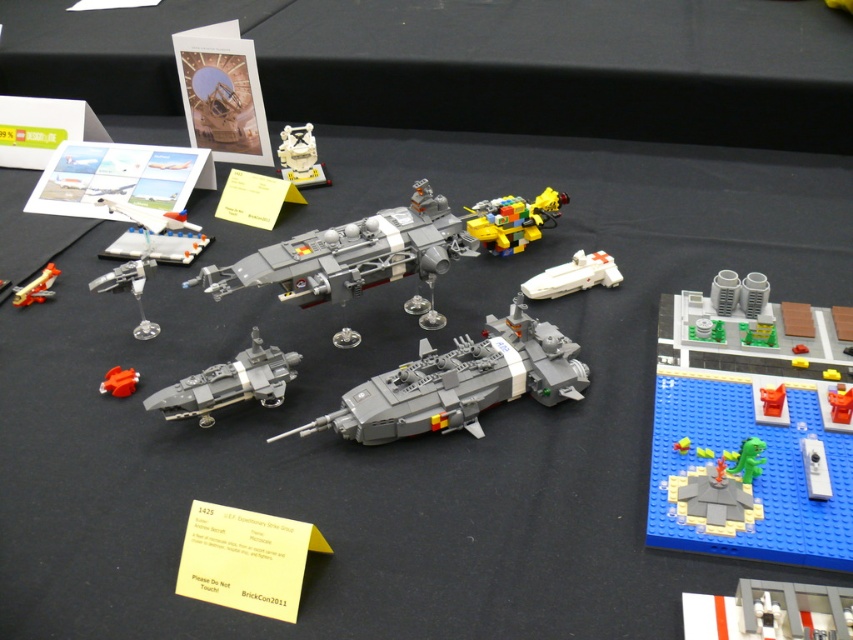
Looking at this image, does smooth plastic building at center appear over bright yellow plastic duck at center?

No, smooth plastic building at center is not above bright yellow plastic duck at center.

Who is higher up, smooth plastic building at center or bright yellow plastic duck at center?

Positioned higher is bright yellow plastic duck at center.

The height and width of the screenshot is (640, 853). In order to click on smooth plastic building at center in this screenshot , I will do `click(769, 611)`.

This screenshot has height=640, width=853. What do you see at coordinates (514, 220) in the screenshot?
I see `yellow plastic robot at center` at bounding box center [514, 220].

Can you confirm if yellow plastic robot at center is positioned to the left of white plastic spaceship at center-right?

Indeed, yellow plastic robot at center is positioned on the left side of white plastic spaceship at center-right.

This screenshot has height=640, width=853. What do you see at coordinates (514, 220) in the screenshot?
I see `yellow plastic robot at center` at bounding box center [514, 220].

Where is `yellow plastic robot at center`? yellow plastic robot at center is located at coordinates (514, 220).

Which of these two, smooth plastic building at center or matte silver spaceship at lower left, stands taller?

matte silver spaceship at lower left

Does smooth plastic building at center lie behind matte silver spaceship at lower left?

No, smooth plastic building at center is closer to the viewer.

This screenshot has height=640, width=853. What are the coordinates of `smooth plastic building at center` in the screenshot? It's located at (769, 611).